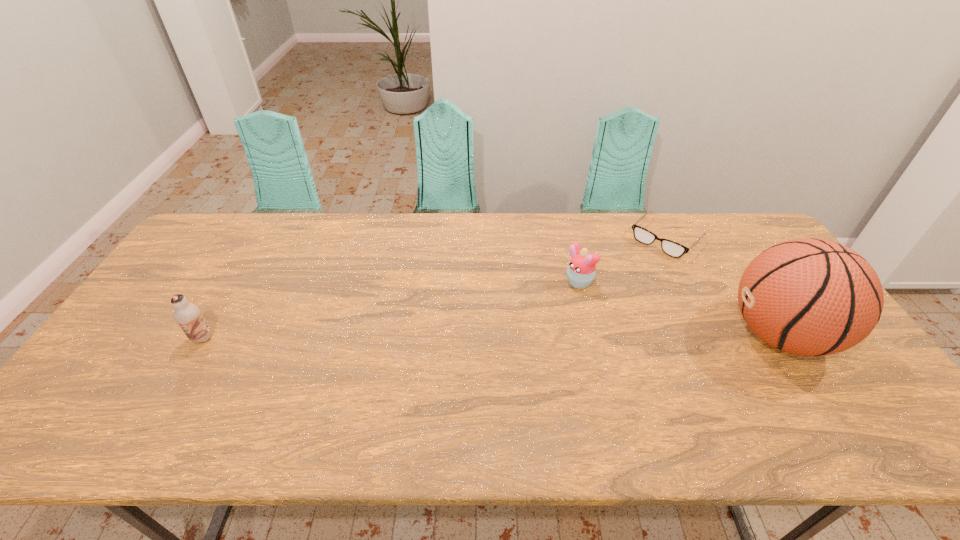
The width and height of the screenshot is (960, 540). I want to click on free space on the desktop that is between the chocolate milk and the basketball and is positioned on the face of the cupcake, so click(x=492, y=336).

Where is `free space on the desktop that is between the chocolate milk and the tallest object and is positioned on the front-facing side of the farthest object`? free space on the desktop that is between the chocolate milk and the tallest object and is positioned on the front-facing side of the farthest object is located at coordinates (569, 336).